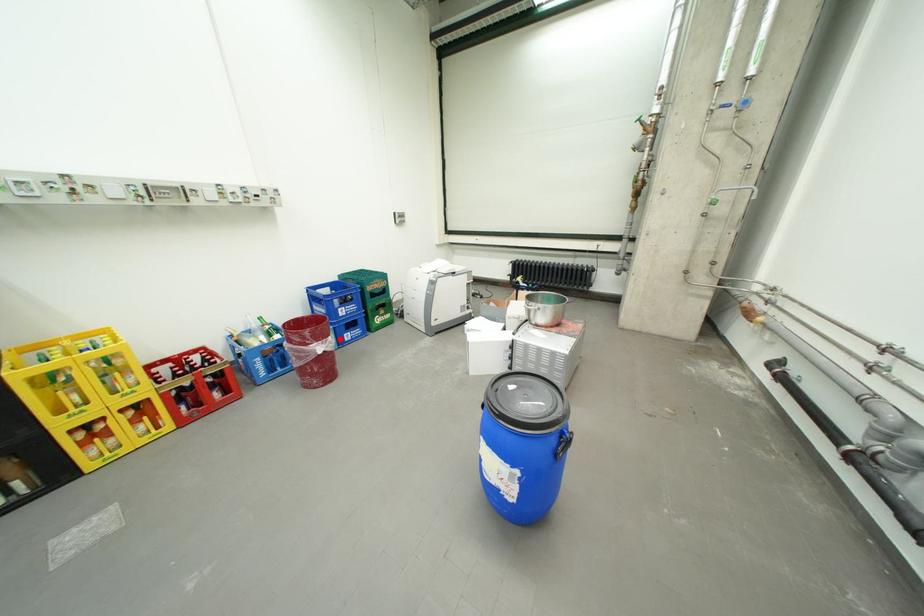
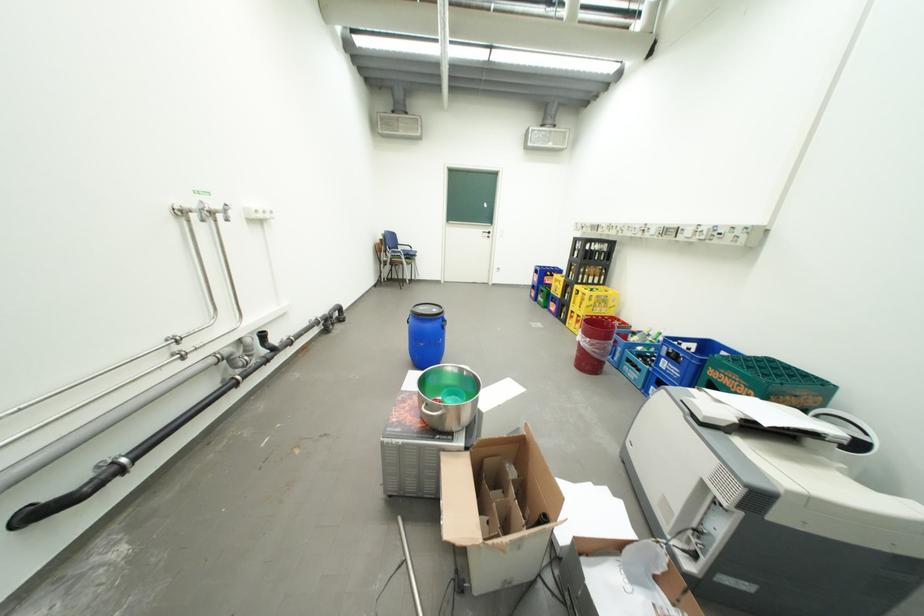
Question: I am providing you with two images of the same scene from different viewpoints. Given a red point in image1, look at the same physical point in image2. Is it:

Choices:
 (A) Closer to the viewpoint
 (B) Farther from the viewpoint

Answer: (B)